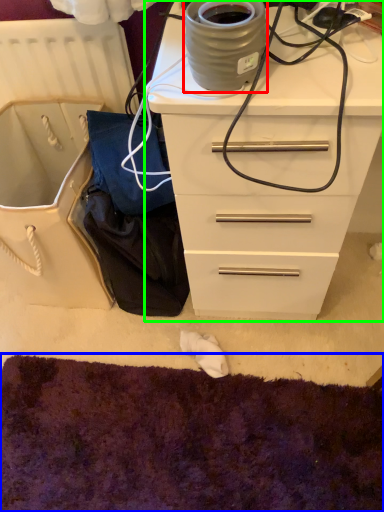
Question: Based on their relative distances, which object is farther from appliance (highlighted by a red box)? Choose from cat bed (highlighted by a blue box) and chest of drawers (highlighted by a green box).

Choices:
 (A) cat bed
 (B) chest of drawers

Answer: (A)